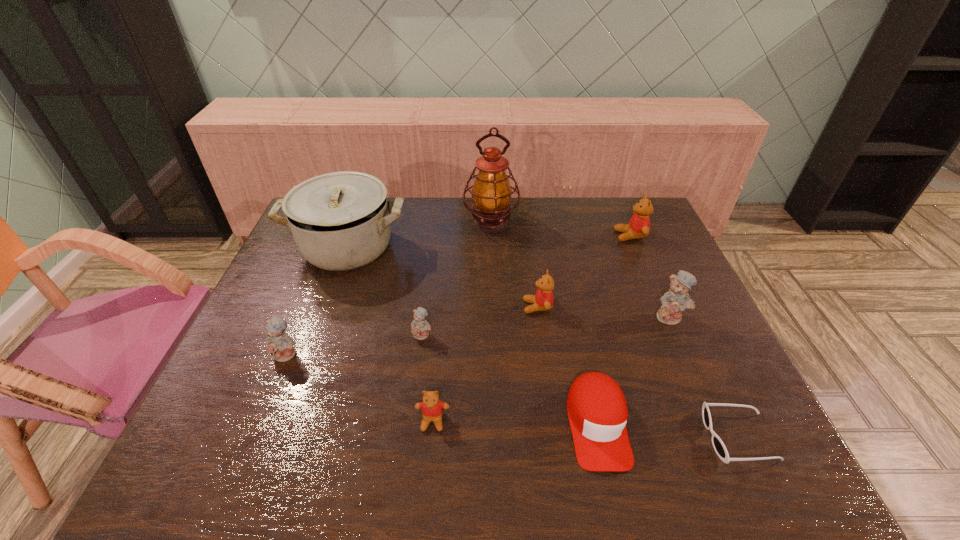
This screenshot has height=540, width=960. In order to click on vacant space located 0.240m on the front-facing side of the biggest blue teddy bear in this screenshot , I will do `click(709, 408)`.

This screenshot has height=540, width=960. Find the location of `vacant space located 0.330m on the front-facing side of the biggest red teddy bear`. vacant space located 0.330m on the front-facing side of the biggest red teddy bear is located at coordinates (516, 236).

Find the location of a particular element. The width and height of the screenshot is (960, 540). free spot located on the front-facing side of the biggest red teddy bear is located at coordinates (512, 236).

This screenshot has height=540, width=960. In order to click on free location located 0.220m on the front-facing side of the biggest red teddy bear in this screenshot , I will do `click(548, 236)`.

Where is `vacant region located on the front-facing side of the second smallest red teddy bear`? vacant region located on the front-facing side of the second smallest red teddy bear is located at coordinates (476, 307).

This screenshot has height=540, width=960. In order to click on free space located 0.330m on the front-facing side of the second smallest red teddy bear in this screenshot , I will do `click(403, 307)`.

At what (x,y) coordinates should I click in order to perform the action: click on vacant space located 0.300m on the front-facing side of the second smallest red teddy bear. Please return your answer as a coordinate pair (x, y). Looking at the image, I should click on (414, 307).

Where is `vacant area situated on the front-facing side of the nearest blue teddy bear`? Image resolution: width=960 pixels, height=540 pixels. vacant area situated on the front-facing side of the nearest blue teddy bear is located at coordinates (236, 480).

You are a GUI agent. You are given a task and a screenshot of the screen. Output one action in this format:
    pyautogui.click(x=<x>, y=<y>)
    Task: Click on the vacant space situated on the front-facing side of the second blue teddy bear from right to left
    The width and height of the screenshot is (960, 540).
    Given the screenshot: What is the action you would take?
    pyautogui.click(x=417, y=384)

The image size is (960, 540). I want to click on vacant area situated on the front-facing side of the nearest red teddy bear, so (429, 461).